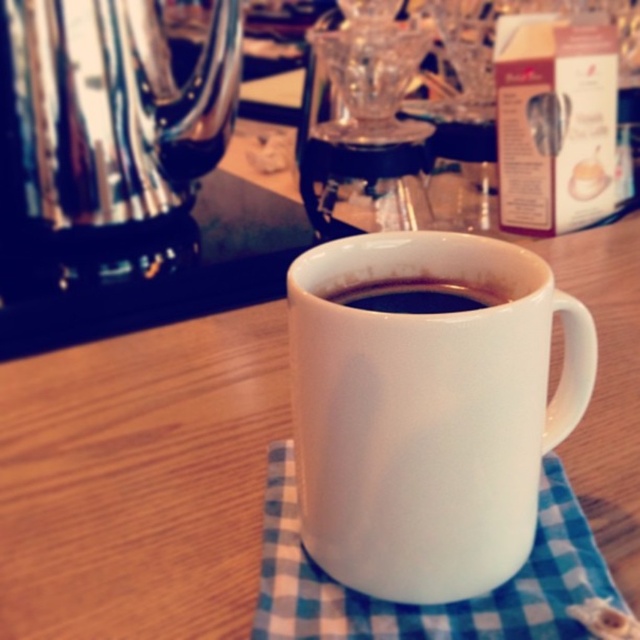
You are a barista preparing a drink and notice the white ceramic mug at center and the black glossy coffee at center. Which object would require more space to store if you were to place them side by side on a shelf?

The white ceramic mug at center is larger in size than the black glossy coffee at center, so it would require more space to store when placed side by side on a shelf.

You are a barista who needs to place a new coffee cup on the table. The white checkered cloth at center and the black glossy coffee at center are already on the table. Where should you place the new cup so it doesn not overlap with either object?

The white checkered cloth at center is to the right of the black glossy coffee at center, so placing the new cup to the left of the black glossy coffee at center would avoid overlapping with both objects.

You are a customer in the cafe and want to reach for the shiny metallic teapot at upper left and the white checkered cloth at center. Which object is closer to your right hand if you are sitting at the table?

The white checkered cloth at center is to the right of the shiny metallic teapot at upper left, so the white checkered cloth at center is closer to your right hand.